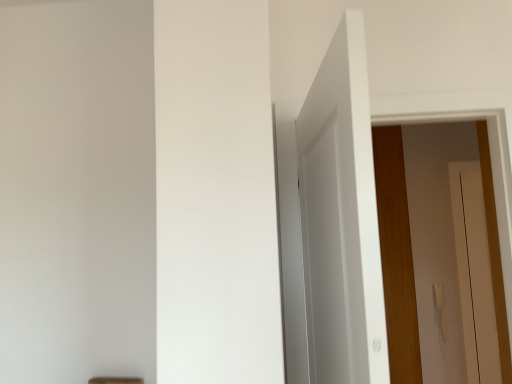
Question: Can you confirm if wooden door at right, which appears as the second door when viewed from the front, is thinner than white matte door at upper center, acting as the first door starting from the front?

Choices:
 (A) no
 (B) yes

Answer: (A)

Question: Considering the relative sizes of wooden door at right, the 1th door viewed from the right, and white matte door at upper center, placed as the second door when sorted from back to front, in the image provided, is wooden door at right, the 1th door viewed from the right, bigger than white matte door at upper center, placed as the second door when sorted from back to front,?

Choices:
 (A) yes
 (B) no

Answer: (A)

Question: Would you say wooden door at right, positioned as the 1th door in back-to-front order, is outside white matte door at upper center, acting as the first door starting from the front?

Choices:
 (A) yes
 (B) no

Answer: (A)

Question: Considering the relative positions of wooden door at right, positioned as the 1th door in back-to-front order, and white matte door at upper center, acting as the second door starting from the right, in the image provided, is wooden door at right, positioned as the 1th door in back-to-front order, to the left of white matte door at upper center, acting as the second door starting from the right, from the viewer's perspective?

Choices:
 (A) no
 (B) yes

Answer: (A)

Question: Is wooden door at right, the 1th door viewed from the right, facing towards white matte door at upper center, placed as the second door when sorted from back to front?

Choices:
 (A) no
 (B) yes

Answer: (A)

Question: Does wooden door at right, which appears as the second door when viewed from the front, come behind white matte door at upper center, acting as the first door starting from the front?

Choices:
 (A) no
 (B) yes

Answer: (B)

Question: From a real-world perspective, does white matte door at upper center, placed as the second door when sorted from back to front, stand above wooden door at right, the 1th door viewed from the right?

Choices:
 (A) yes
 (B) no

Answer: (A)

Question: Does white matte door at upper center, acting as the first door starting from the front, touch wooden door at right, positioned as the 1th door in back-to-front order?

Choices:
 (A) no
 (B) yes

Answer: (A)

Question: Does white matte door at upper center, the first door viewed from the left, appear on the left side of wooden door at right, which appears as the second door when viewed from the front?

Choices:
 (A) no
 (B) yes

Answer: (B)

Question: Does white matte door at upper center, placed as the second door when sorted from back to front, have a lesser width compared to wooden door at right, the 1th door viewed from the right?

Choices:
 (A) yes
 (B) no

Answer: (A)

Question: Does white matte door at upper center, acting as the first door starting from the front, have a greater height compared to wooden door at right, the 1th door viewed from the right?

Choices:
 (A) yes
 (B) no

Answer: (B)

Question: Is wooden door at right, which appears as the second door when viewed from the front, inside white matte door at upper center, acting as the first door starting from the front?

Choices:
 (A) yes
 (B) no

Answer: (B)

Question: From a real-world perspective, is white matte door at upper center, placed as the second door when sorted from back to front, positioned above or below wooden door at right, which appears as the second door when viewed from the front?

Choices:
 (A) above
 (B) below

Answer: (A)